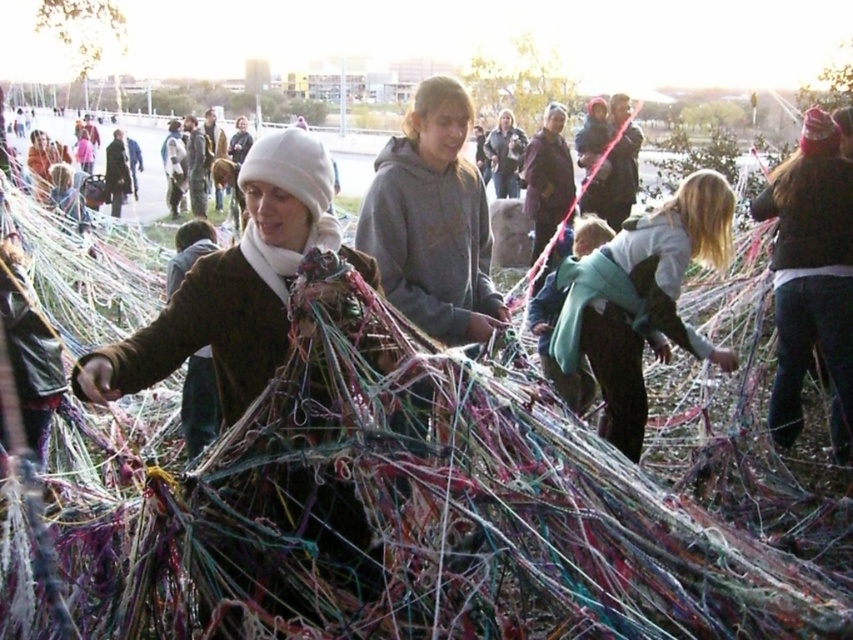
You are standing at the origin point in the scene. Which direction should you move to reach the gray hoodie at center?

The gray hoodie at center is located at point 0.347 on the x and 0.508 on the y. Since you are at the origin, you should move to the right and forward to reach it.

You are part of the group handling the colorful threads. You need to pass a thread from the gray hoodie at center to the light blue fabric at center. Which direction should you move the thread?

The gray hoodie at center is to the left of the light blue fabric at center, so you should move the thread to the right to pass it from the gray hoodie at center to the light blue fabric at center.

You are a participant in this thread activity and need to pass a thread from the gray hoodie at center to the light blue fabric at center. Can you reach them without moving your position?

The distance between the gray hoodie at center and the light blue fabric at center is 1.77 meters. Since the thread can be stretched or guided across the distance, you can likely pass the thread between them without needing to move your position.